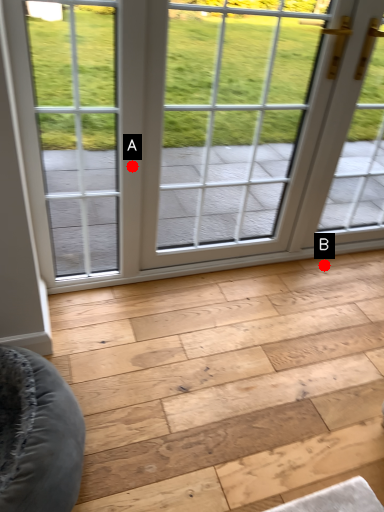
Question: Two points are circled on the image, labeled by A and B beside each circle. Which point appears closest to the camera in this image?

Choices:
 (A) A is closer
 (B) B is closer

Answer: (A)